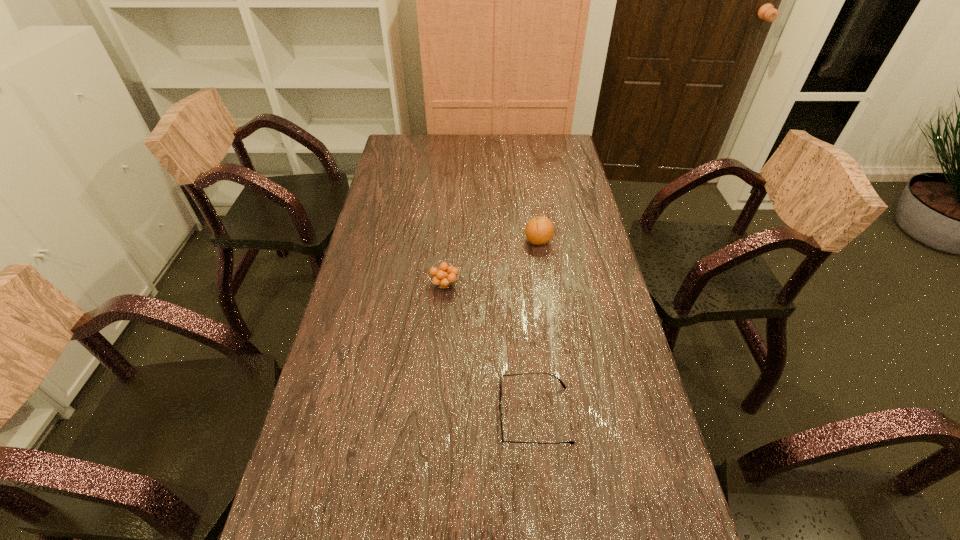
The image size is (960, 540). What are the coordinates of `the right orange fruit` in the screenshot? It's located at (539, 230).

Identify the location of the tallest object. [x=539, y=230].

At what (x,y) coordinates should I click in order to perform the action: click on the leftmost object. Please return your answer as a coordinate pair (x, y). The image size is (960, 540). Looking at the image, I should click on (444, 276).

Locate an element on the screen. This screenshot has height=540, width=960. the left orange fruit is located at coordinates (444, 276).

Locate an element on the screen. This screenshot has height=540, width=960. the nearest object is located at coordinates (x=500, y=385).

The image size is (960, 540). In order to click on spectacles in this screenshot , I will do `click(500, 385)`.

Where is `free region located 0.260m on the front of the tallest object`? Image resolution: width=960 pixels, height=540 pixels. free region located 0.260m on the front of the tallest object is located at coordinates (548, 311).

Where is `vacant space located on the back of the left orange fruit`? Image resolution: width=960 pixels, height=540 pixels. vacant space located on the back of the left orange fruit is located at coordinates (447, 246).

Find the location of a particular element. This screenshot has width=960, height=540. free space located 0.140m on the front-facing side of the nearest object is located at coordinates (438, 414).

You are a GUI agent. You are given a task and a screenshot of the screen. Output one action in this format:
    pyautogui.click(x=<x>, y=<y>)
    Task: Click on the vacant space situated on the front-facing side of the nearest object
    Image resolution: width=960 pixels, height=540 pixels.
    Given the screenshot: What is the action you would take?
    pyautogui.click(x=352, y=414)